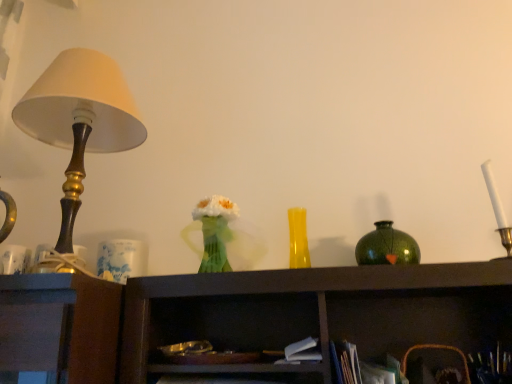
Measure the distance between yellow glass vase at center, which is counted as the first vase, starting from the left, and camera.

3.95 feet.

Measure the distance between point [218,199] and camera.

They are 1.10 meters apart.

Locate an element on the screen. Image resolution: width=512 pixels, height=384 pixels. translucent green vase at center is located at coordinates (215, 231).

The height and width of the screenshot is (384, 512). What do you see at coordinates (387, 246) in the screenshot? I see `green speckled vase at upper right, the 1th vase positioned from the right` at bounding box center [387, 246].

You are a GUI agent. You are given a task and a screenshot of the screen. Output one action in this format:
    pyautogui.click(x=<x>, y=<y>)
    Task: Click on the matte gold lamp at left
    
    Given the screenshot: What is the action you would take?
    pyautogui.click(x=80, y=120)

The height and width of the screenshot is (384, 512). Identify the location of yellow glass vase at center, which is counted as the first vase, starting from the left. (298, 239).

From a real-world perspective, who is located lower, matte gold lamp at left or yellow glass vase at center, which is counted as the first vase, starting from the left?

From a 3D spatial view, yellow glass vase at center, which is counted as the first vase, starting from the left, is below.

Is the position of matte gold lamp at left more distant than that of yellow glass vase at center, which is counted as the first vase, starting from the left?

No, matte gold lamp at left is in front of yellow glass vase at center, which is counted as the first vase, starting from the left.

From the image's perspective, which one is positioned higher, matte gold lamp at left or yellow glass vase at center, which is counted as the first vase, starting from the left?

From the image's view, matte gold lamp at left is above.

Is matte gold lamp at left situated inside yellow glass vase at center, which is counted as the first vase, starting from the left, or outside?

matte gold lamp at left is outside yellow glass vase at center, which is counted as the first vase, starting from the left.

Considering the relative sizes of translucent green vase at center and yellow glass vase at center, which is the 2th vase from right to left, in the image provided, is translucent green vase at center wider than yellow glass vase at center, which is the 2th vase from right to left,?

Yes, translucent green vase at center is wider than yellow glass vase at center, which is the 2th vase from right to left.

From the image's perspective, would you say translucent green vase at center is shown under yellow glass vase at center, which is counted as the first vase, starting from the left?

No.

Does translucent green vase at center touch yellow glass vase at center, which is counted as the first vase, starting from the left?

No.

What's the angular difference between translucent green vase at center and yellow glass vase at center, which is the 2th vase from right to left,'s facing directions?

They differ by 0.000452 degrees in their facing directions.

Is translucent green vase at center not close to green speckled vase at upper right, the 1th vase positioned from the right?

No.

How different are the orientations of translucent green vase at center and green speckled vase at upper right, the 1th vase positioned from the right, in degrees?

0.00271 degrees.

Is translucent green vase at center smaller than green speckled vase at upper right, the second vase when ordered from left to right?

No, translucent green vase at center is not smaller than green speckled vase at upper right, the second vase when ordered from left to right.

From a real-world perspective, is translucent green vase at center under green speckled vase at upper right, the second vase when ordered from left to right?

No.

Is green speckled vase at upper right, the 1th vase positioned from the right, thinner than matte gold lamp at left?

Indeed, green speckled vase at upper right, the 1th vase positioned from the right, has a lesser width compared to matte gold lamp at left.

Which is behind, point (372, 245) or point (104, 94)?

The point (372, 245) is behind.

Which is correct: green speckled vase at upper right, the 1th vase positioned from the right, is inside matte gold lamp at left, or outside of it?

green speckled vase at upper right, the 1th vase positioned from the right, exists outside the volume of matte gold lamp at left.

Which object is further away from the camera, yellow glass vase at center, which is the 2th vase from right to left, or green speckled vase at upper right, the second vase when ordered from left to right?

yellow glass vase at center, which is the 2th vase from right to left, is further away from the camera.

From the image's perspective, is yellow glass vase at center, which is counted as the first vase, starting from the left, positioned above or below green speckled vase at upper right, the 1th vase positioned from the right?

Based on their image positions, yellow glass vase at center, which is counted as the first vase, starting from the left, is located above green speckled vase at upper right, the 1th vase positioned from the right.

Based on the photo, is yellow glass vase at center, which is the 2th vase from right to left, facing away from green speckled vase at upper right, the second vase when ordered from left to right?

No, yellow glass vase at center, which is the 2th vase from right to left, is not facing away from green speckled vase at upper right, the second vase when ordered from left to right.

From a real-world perspective, who is located lower, yellow glass vase at center, which is the 2th vase from right to left, or green speckled vase at upper right, the 1th vase positioned from the right?

In real-world perspective, green speckled vase at upper right, the 1th vase positioned from the right, is lower.

You are a GUI agent. You are given a task and a screenshot of the screen. Output one action in this format:
    pyautogui.click(x=<x>, y=<y>)
    Task: Click on the 2nd vase counting from the right side of the matte gold lamp at left
    
    Given the screenshot: What is the action you would take?
    pyautogui.click(x=387, y=246)

From the picture: Is matte gold lamp at left taller or shorter than green speckled vase at upper right, the second vase when ordered from left to right?

Considering their sizes, matte gold lamp at left has more height than green speckled vase at upper right, the second vase when ordered from left to right.

Which is further, (113, 67) or (403, 249)?

Positioned behind is point (113, 67).

Is matte gold lamp at left placed right next to green speckled vase at upper right, the second vase when ordered from left to right?

No, matte gold lamp at left is not next to green speckled vase at upper right, the second vase when ordered from left to right.

Considering the sizes of objects yellow glass vase at center, which is the 2th vase from right to left, and matte gold lamp at left in the image provided, who is bigger, yellow glass vase at center, which is the 2th vase from right to left, or matte gold lamp at left?

matte gold lamp at left.

Is yellow glass vase at center, which is the 2th vase from right to left, taller or shorter than matte gold lamp at left?

yellow glass vase at center, which is the 2th vase from right to left, is shorter than matte gold lamp at left.

From a real-world perspective, who is located higher, yellow glass vase at center, which is the 2th vase from right to left, or matte gold lamp at left?

From a 3D spatial view, matte gold lamp at left is above.

Between point (294, 248) and point (90, 99), which one is positioned behind?

Point (294, 248)

At what (x,y) coordinates should I click in order to perform the action: click on lamp in front of the yellow glass vase at center, which is counted as the first vase, starting from the left. Please return your answer as a coordinate pair (x, y). The width and height of the screenshot is (512, 384). Looking at the image, I should click on (80, 120).

Where is `vase that appears above the translucent green vase at center (from a real-world perspective)`? This screenshot has height=384, width=512. vase that appears above the translucent green vase at center (from a real-world perspective) is located at coordinates (298, 239).

Which object lies nearer to the anchor point translucent green vase at center, matte gold lamp at left or yellow glass vase at center, which is the 2th vase from right to left?

yellow glass vase at center, which is the 2th vase from right to left, is positioned closer to the anchor translucent green vase at center.

Looking at the image, which one is located further to green speckled vase at upper right, the second vase when ordered from left to right, yellow glass vase at center, which is the 2th vase from right to left, or matte gold lamp at left?

The object further to green speckled vase at upper right, the second vase when ordered from left to right, is matte gold lamp at left.

Estimate the real-world distances between objects in this image. Which object is further from matte gold lamp at left, yellow glass vase at center, which is the 2th vase from right to left, or translucent green vase at center?

yellow glass vase at center, which is the 2th vase from right to left, is positioned further to the anchor matte gold lamp at left.

Considering their positions, is green speckled vase at upper right, the second vase when ordered from left to right, positioned closer to yellow glass vase at center, which is counted as the first vase, starting from the left, than translucent green vase at center?

green speckled vase at upper right, the second vase when ordered from left to right, is positioned closer to the anchor yellow glass vase at center, which is counted as the first vase, starting from the left.

Based on their spatial positions, is green speckled vase at upper right, the second vase when ordered from left to right, or matte gold lamp at left further from translucent green vase at center?

Based on the image, green speckled vase at upper right, the second vase when ordered from left to right, appears to be further to translucent green vase at center.

Which object lies further to the anchor point yellow glass vase at center, which is the 2th vase from right to left, translucent green vase at center or matte gold lamp at left?

matte gold lamp at left is further to yellow glass vase at center, which is the 2th vase from right to left.

Based on their spatial positions, is green speckled vase at upper right, the 1th vase positioned from the right, or yellow glass vase at center, which is the 2th vase from right to left, closer to matte gold lamp at left?

yellow glass vase at center, which is the 2th vase from right to left.

Which object lies nearer to the anchor point translucent green vase at center, yellow glass vase at center, which is counted as the first vase, starting from the left, or green speckled vase at upper right, the 1th vase positioned from the right?

yellow glass vase at center, which is counted as the first vase, starting from the left, is closer to translucent green vase at center.

Find the location of `vase between matte gold lamp at left and green speckled vase at upper right, the 1th vase positioned from the right`. vase between matte gold lamp at left and green speckled vase at upper right, the 1th vase positioned from the right is located at coordinates 298,239.

I want to click on floral arrangement between matte gold lamp at left and green speckled vase at upper right, the 1th vase positioned from the right, from left to right, so click(215, 231).

I want to click on floral arrangement between matte gold lamp at left and yellow glass vase at center, which is the 2th vase from right to left, in the horizontal direction, so coord(215,231).

The height and width of the screenshot is (384, 512). What are the coordinates of `vase between translucent green vase at center and green speckled vase at upper right, the 1th vase positioned from the right` in the screenshot? It's located at (298, 239).